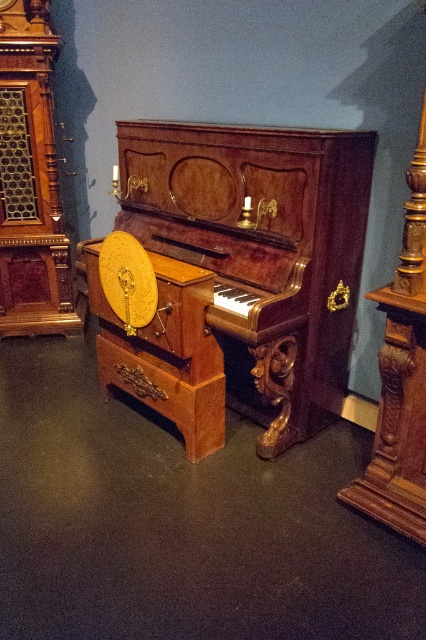
You are moving a small potted plant that is 0.5 meters wide. You want to place it between the mahogany polished piano at center and the polished wood clock at left. Is there enough space for the plant?

The mahogany polished piano at center is bigger than the polished wood clock at left. Therefore, there is enough space between them to place the 0.5 meters wide potted plant.

You are standing in front of the vintage upright piano and need to locate two specific points marked on the image. The first point is at coordinates point(x=336, y=138) and the second is at point(x=17, y=152). Which of these two points is closer to you?

Point(x=336, y=138) is in front of point(x=17, y=152), so it is closer to you.